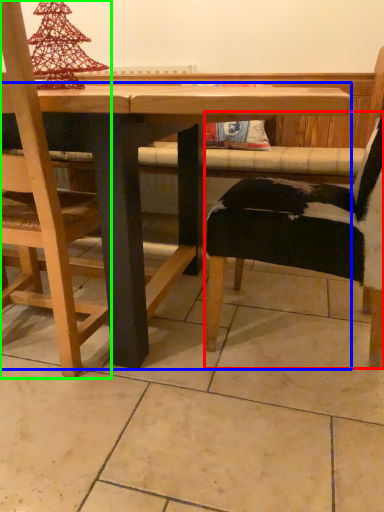
Question: Considering the real-world distances, which object is closest to chair (highlighted by a red box)? table (highlighted by a blue box) or chair (highlighted by a green box).

Choices:
 (A) table
 (B) chair

Answer: (A)